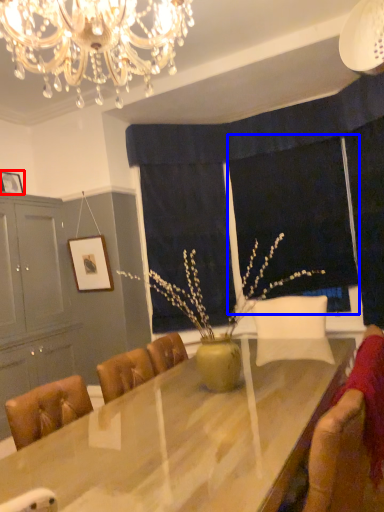
Question: Which point is further to the camera, picture frame (highlighted by a red box) or window screen (highlighted by a blue box)?

Choices:
 (A) picture frame
 (B) window screen

Answer: (B)